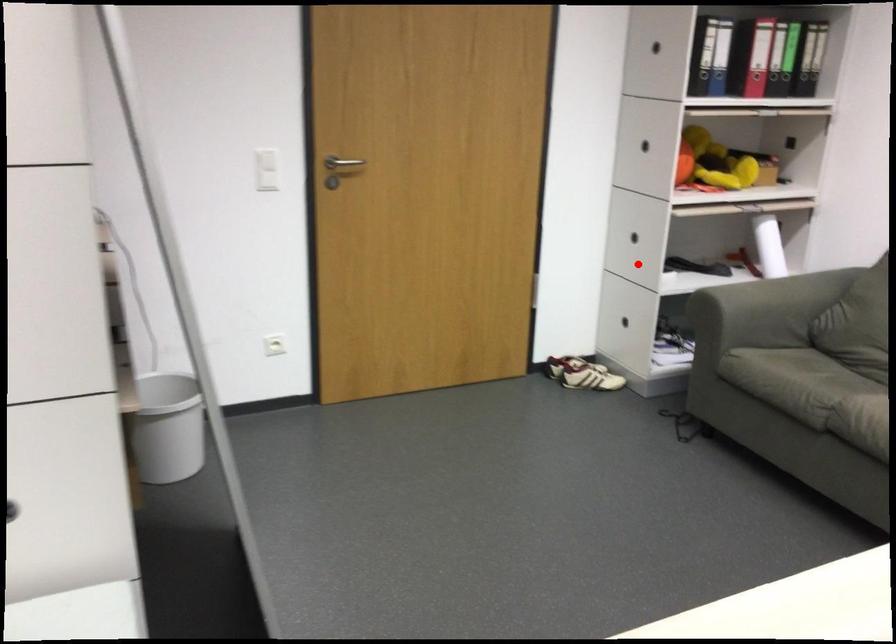
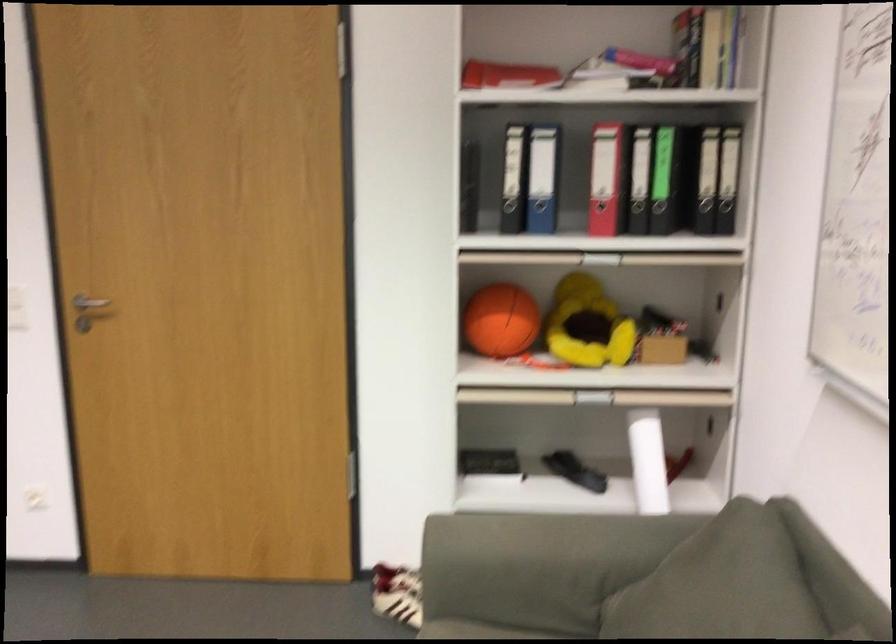
Question: I am providing you with two images of the same scene from different viewpoints. In image1, a red point is highlighted. Considering the same 3D point in image2, which of the following is correct?

Choices:
 (A) It is closer
 (B) It is farther

Answer: (A)